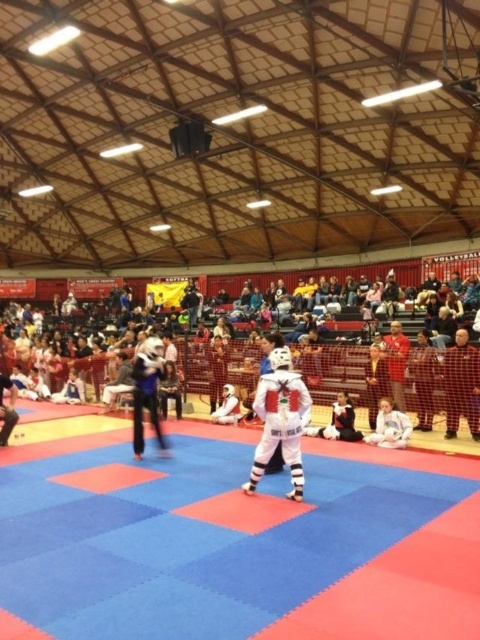
You are a photographer standing behind the competitors. You want to take a photo of the white matte karate gi at center without the white fabric crowd at center blocking it. Is this possible?

The white fabric crowd at center is bigger than the white matte karate gi at center. Since the crowd is larger, it may block the view of the karate gi. Therefore, it might not be possible to take a clear photo without obstruction.

You are a photographer positioned at the back of the hall. You need to take a photo of the white matte karate uniform at center without the white fabric crowd at center blocking it. What should you do?

The white fabric crowd at center is larger than the white matte karate uniform at center, so you should adjust your camera angle or move closer to the uniform to avoid the crowd blocking the view.

You are a photographer positioned at the back of the hall. You want to take a photo of the white matte karate uniform at center without the white fabric crowd at center blocking it. Is this possible given their relative heights?

The white fabric crowd at center is taller than the white matte karate uniform at center, so it will block the view. Move closer or adjust your angle to avoid the obstruction.